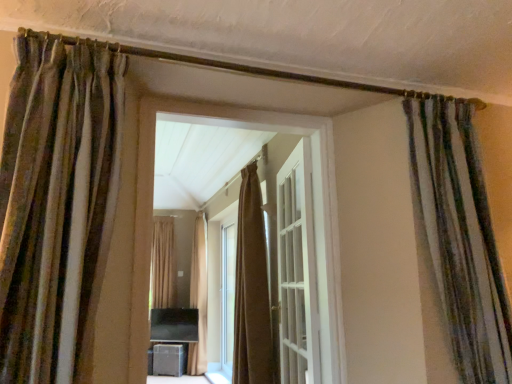
Question: Which direction should I rotate to look at brown textured curtain at center, the 5th curtain from the right?

Choices:
 (A) left
 (B) right

Answer: (A)

Question: Can you confirm if brown textured curtain at center, which appears as the first curtain when viewed from the back, is wider than brown velvet curtain at center, which is the 4th curtain from left to right?

Choices:
 (A) no
 (B) yes

Answer: (A)

Question: Does brown textured curtain at center, placed as the fifth curtain when sorted from front to back, have a smaller size compared to brown velvet curtain at center, acting as the 3th curtain starting from the back?

Choices:
 (A) yes
 (B) no

Answer: (A)

Question: Is brown textured curtain at center, which appears as the first curtain when viewed from the back, closer to camera compared to brown velvet curtain at center, the 3th curtain viewed from the front?

Choices:
 (A) no
 (B) yes

Answer: (A)

Question: Does brown textured curtain at center, marked as the first curtain in a left-to-right arrangement, appear on the right side of brown velvet curtain at center, which is the 2th curtain from right to left?

Choices:
 (A) yes
 (B) no

Answer: (B)

Question: Considering the relative sizes of brown textured curtain at center, placed as the fifth curtain when sorted from front to back, and brown velvet curtain at center, which is the 2th curtain from right to left, in the image provided, is brown textured curtain at center, placed as the fifth curtain when sorted from front to back, bigger than brown velvet curtain at center, which is the 2th curtain from right to left,?

Choices:
 (A) yes
 (B) no

Answer: (B)

Question: Can you confirm if brown textured curtain at center, the 5th curtain from the right, is positioned to the left of brown velvet curtain at center, the 3th curtain viewed from the front?

Choices:
 (A) no
 (B) yes

Answer: (B)

Question: Does matte black speaker at lower center touch beige fabric curtain at center, which is counted as the 4th curtain, starting from the right?

Choices:
 (A) yes
 (B) no

Answer: (B)

Question: Is matte black speaker at lower center looking in the opposite direction of beige fabric curtain at center, which is counted as the 2th curtain, starting from the back?

Choices:
 (A) yes
 (B) no

Answer: (B)

Question: Can you confirm if matte black speaker at lower center is taller than beige fabric curtain at center, which is counted as the 4th curtain, starting from the right?

Choices:
 (A) yes
 (B) no

Answer: (B)

Question: Would you say matte black speaker at lower center is outside beige fabric curtain at center, the 4th curtain from the front?

Choices:
 (A) yes
 (B) no

Answer: (A)

Question: From a real-world perspective, is matte black speaker at lower center over beige fabric curtain at center, the 4th curtain from the front?

Choices:
 (A) no
 (B) yes

Answer: (A)

Question: Can beige fabric curtain at center, the 4th curtain from the front, be found inside matte black speaker at lower center?

Choices:
 (A) no
 (B) yes

Answer: (A)

Question: Can you confirm if brown velvet curtain at center, which is the 2th curtain from right to left, is shorter than brown textured curtain at left, which is the third curtain in right-to-left order?

Choices:
 (A) yes
 (B) no

Answer: (B)